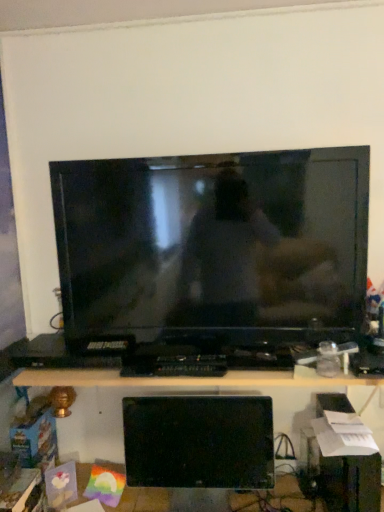
Question: Is black plastic desk at lower center closer to the viewer compared to black glossy monitor at lower center?

Choices:
 (A) no
 (B) yes

Answer: (B)

Question: Is black plastic desk at lower center turned away from black glossy monitor at lower center?

Choices:
 (A) yes
 (B) no

Answer: (B)

Question: Does black plastic desk at lower center turn towards black glossy monitor at lower center?

Choices:
 (A) yes
 (B) no

Answer: (B)

Question: Is black plastic desk at lower center directly adjacent to black glossy monitor at lower center?

Choices:
 (A) no
 (B) yes

Answer: (A)

Question: From the image's perspective, is black plastic desk at lower center over black glossy monitor at lower center?

Choices:
 (A) yes
 (B) no

Answer: (A)

Question: Is point (332, 381) positioned closer to the camera than point (324, 207)?

Choices:
 (A) farther
 (B) closer

Answer: (B)

Question: Is black plastic desk at lower center situated inside matte black television at center or outside?

Choices:
 (A) outside
 (B) inside

Answer: (A)

Question: Relative to matte black television at center, is black plastic desk at lower center in front or behind?

Choices:
 (A) front
 (B) behind

Answer: (A)

Question: From a real-world perspective, relative to matte black television at center, is black plastic desk at lower center vertically above or below?

Choices:
 (A) above
 (B) below

Answer: (B)

Question: Would you say black glossy monitor at lower center is inside or outside black plastic desk at lower center?

Choices:
 (A) inside
 (B) outside

Answer: (A)

Question: From a real-world perspective, is black glossy monitor at lower center above or below black plastic desk at lower center?

Choices:
 (A) above
 (B) below

Answer: (B)

Question: Does point (215, 410) appear closer or farther from the camera than point (44, 382)?

Choices:
 (A) closer
 (B) farther

Answer: (B)

Question: From the image's perspective, relative to black plastic desk at lower center, is black glossy monitor at lower center above or below?

Choices:
 (A) below
 (B) above

Answer: (A)

Question: Considering the positions of matte black television at center and black glossy monitor at lower center in the image, is matte black television at center wider or thinner than black glossy monitor at lower center?

Choices:
 (A) wide
 (B) thin

Answer: (A)

Question: Is matte black television at center taller or shorter than black glossy monitor at lower center?

Choices:
 (A) short
 (B) tall

Answer: (B)